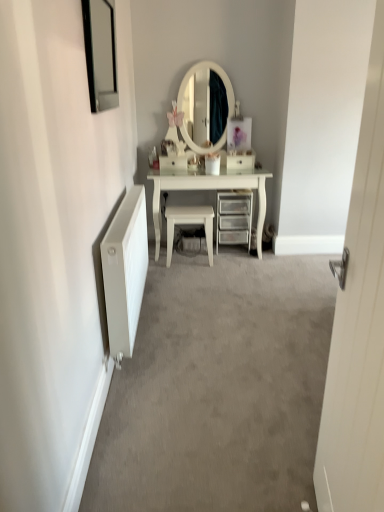
Question: Would you say clear plastic drawers at center contains white wooden door at right?

Choices:
 (A) no
 (B) yes

Answer: (A)

Question: From a real-world perspective, is clear plastic drawers at center over white wooden door at right?

Choices:
 (A) yes
 (B) no

Answer: (B)

Question: From the image's perspective, is clear plastic drawers at center below white wooden door at right?

Choices:
 (A) no
 (B) yes

Answer: (A)

Question: Can you confirm if clear plastic drawers at center is smaller than white wooden door at right?

Choices:
 (A) no
 (B) yes

Answer: (B)

Question: From the image's perspective, is clear plastic drawers at center on white wooden door at right?

Choices:
 (A) yes
 (B) no

Answer: (A)

Question: From the image's perspective, is white radiator at left above or below black glass picture frame at upper left?

Choices:
 (A) above
 (B) below

Answer: (B)

Question: Is white radiator at left situated inside black glass picture frame at upper left or outside?

Choices:
 (A) outside
 (B) inside

Answer: (A)

Question: Considering the relative positions of white radiator at left and black glass picture frame at upper left in the image provided, is white radiator at left to the left or to the right of black glass picture frame at upper left?

Choices:
 (A) left
 (B) right

Answer: (B)

Question: Looking at their shapes, would you say white radiator at left is wider or thinner than black glass picture frame at upper left?

Choices:
 (A) thin
 (B) wide

Answer: (B)

Question: In the image, is white glossy stool at center positioned in front of or behind white matte radiator at left?

Choices:
 (A) front
 (B) behind

Answer: (B)

Question: Do you think white glossy stool at center is within white matte radiator at left, or outside of it?

Choices:
 (A) outside
 (B) inside

Answer: (A)

Question: Considering the positions of white glossy stool at center and white matte radiator at left in the image, is white glossy stool at center wider or thinner than white matte radiator at left?

Choices:
 (A) wide
 (B) thin

Answer: (A)

Question: From a real-world perspective, is white glossy stool at center above or below white matte radiator at left?

Choices:
 (A) above
 (B) below

Answer: (B)

Question: From a real-world perspective, is white radiator at left above or below white matte radiator at left?

Choices:
 (A) below
 (B) above

Answer: (A)

Question: Choose the correct answer: Is white radiator at left inside white matte radiator at left or outside it?

Choices:
 (A) outside
 (B) inside

Answer: (A)